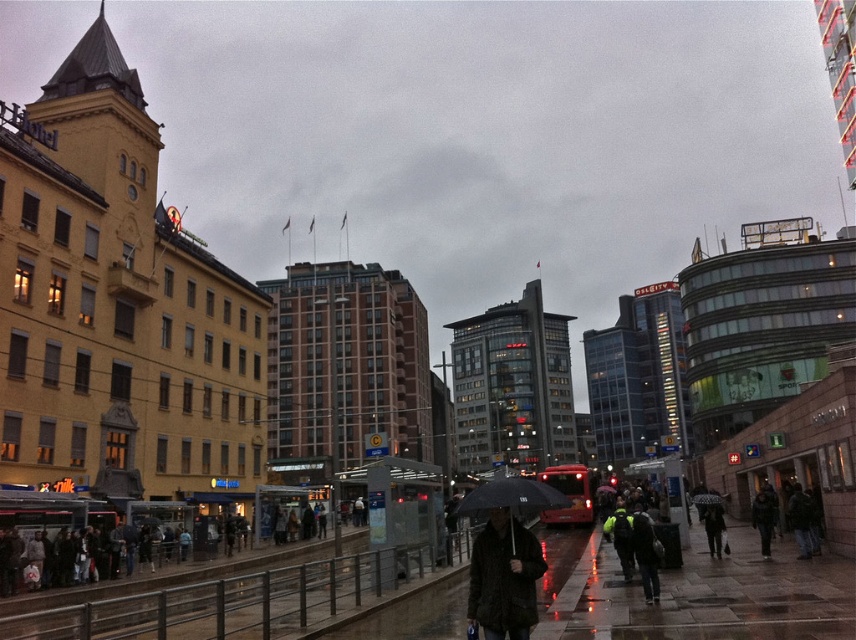
Identify the location of dark brown leather jacket at center. The width and height of the screenshot is (856, 640). (504, 577).

Can you confirm if shiny wet pavement at lower center is thinner than dark brown leather jacket at center?

Incorrect, shiny wet pavement at lower center's width is not less than dark brown leather jacket at center's.

Is point (563, 589) farther from viewer compared to point (522, 536)?

Yes, it is behind point (522, 536).

Identify the location of shiny wet pavement at lower center. (693, 593).

Does dark gray fabric crowd at lower left have a larger size compared to black matte umbrella at center?

Actually, dark gray fabric crowd at lower left might be smaller than black matte umbrella at center.

Is point (3, 573) farther from camera compared to point (512, 490)?

Yes, it is behind point (512, 490).

Is point (49, 531) in front of point (526, 512)?

No, it is behind (526, 512).

Find the location of `dark gray fabric crowd at lower left`. dark gray fabric crowd at lower left is located at coordinates (107, 541).